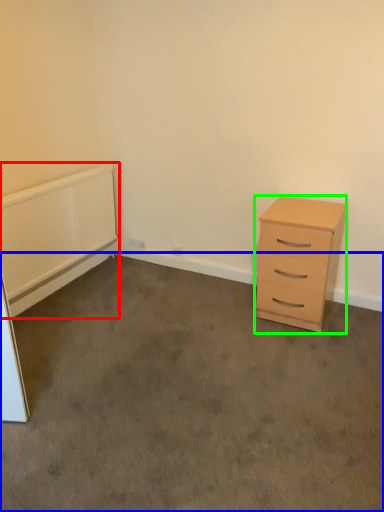
Question: Estimate the real-world distances between objects in this image. Which object is farther from radiator (highlighted by a red box), plain (highlighted by a blue box) or chest of drawers (highlighted by a green box)?

Choices:
 (A) plain
 (B) chest of drawers

Answer: (B)